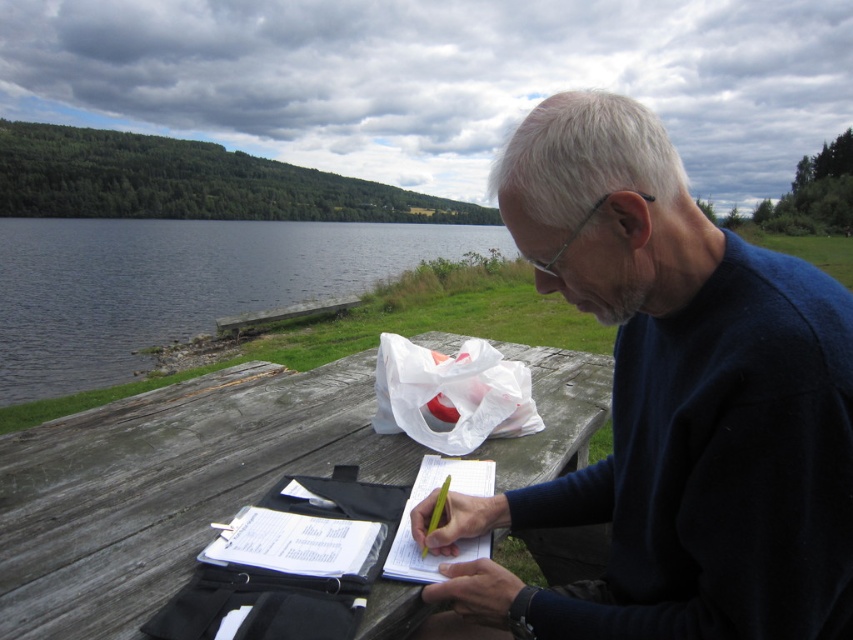
You are a photographer planning to take a picture of the scene. You want to ensure that both the weathered wood picnic table at center and the smooth water at left are clearly visible in the frame. Given their positions, will you need to adjust your camera angle to include both?

The weathered wood picnic table at center is located below the smooth water at left, so you will need to adjust your camera angle to include both in the frame.

You are a delivery person who needs to place a package on the picnic table. The package is 60 centimeters long. Can you fit it between the dark blue sweater at center and the edge of the weathered wood picnic table at center?

The distance between the dark blue sweater at center and the weathered wood picnic table at center is 59.94 centimeters. Since the package is 60 centimeters long, it will not fit in the available space.

You are a photographer trying to capture the scene of the man at the wooden picnic table. You want to ensure that both the dark blue sweater at center and the smooth water at left are clearly visible in your photo. Based on their sizes, which object should you focus on first to ensure proper framing?

The dark blue sweater at center has a lesser width compared to smooth water at left, so you should focus on the smooth water at left first as it is wider and will require more attention in framing.